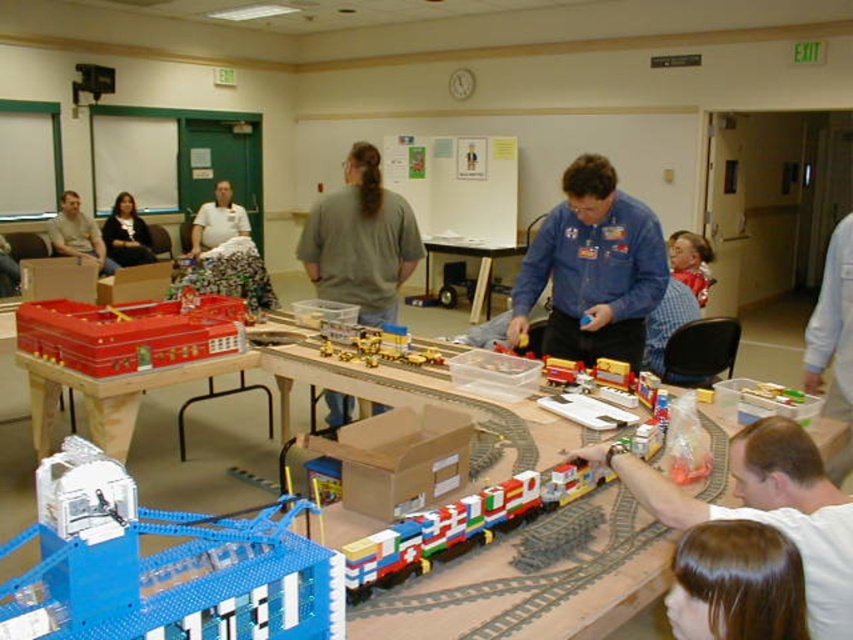
Question: Can you confirm if gray matte shirt at center is positioned above shiny plastic train car at left?

Choices:
 (A) yes
 (B) no

Answer: (A)

Question: Is white matte shirt at lower right closer to the viewer compared to brown hair at lower right?

Choices:
 (A) no
 (B) yes

Answer: (A)

Question: Among these objects, which one is nearest to the camera?

Choices:
 (A) white matte shirt at lower right
 (B) matte gray shirt at upper left

Answer: (A)

Question: Which point is farther from the camera taking this photo?

Choices:
 (A) (142, 241)
 (B) (688, 275)

Answer: (A)

Question: Which point appears closest to the camera in this image?

Choices:
 (A) (675, 248)
 (B) (387, 241)

Answer: (B)

Question: Is brown hair at lower right to the left of floral skirt at center from the viewer's perspective?

Choices:
 (A) yes
 (B) no

Answer: (B)